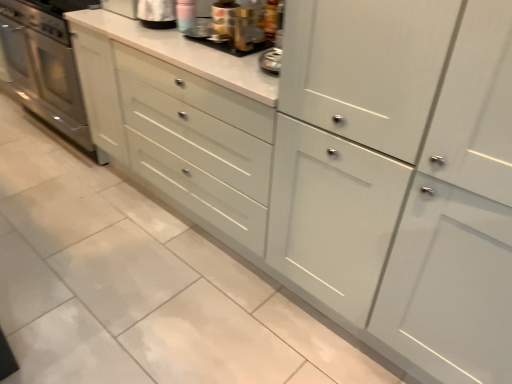
Question: In terms of size, does metallic silver toaster at upper center, which is the third appliance from right to left, appear bigger or smaller than metallic gold coffee pot at upper center, the 3th appliance positioned from the left?

Choices:
 (A) big
 (B) small

Answer: (A)

Question: From a real-world perspective, is metallic silver toaster at upper center, positioned as the 1th appliance in left-to-right order, physically located above or below metallic gold coffee pot at upper center, the 1th appliance when ordered from right to left?

Choices:
 (A) above
 (B) below

Answer: (B)

Question: Which object is positioned closest to the metallic silver toaster at upper center, which appears as the 2th appliance when viewed from the left?

Choices:
 (A) stainless steel oven at left
 (B) metallic gold coffee pot at upper center, the 1th appliance when ordered from right to left
 (C) metallic silver toaster at upper center, which is the third appliance from right to left

Answer: (B)

Question: Which object is the farthest from the metallic gold coffee pot at upper center, the 1th appliance when ordered from right to left?

Choices:
 (A) metallic silver toaster at upper center, which appears as the 2th appliance when viewed from the left
 (B) metallic silver toaster at upper center, positioned as the 1th appliance in left-to-right order
 (C) stainless steel oven at left

Answer: (C)